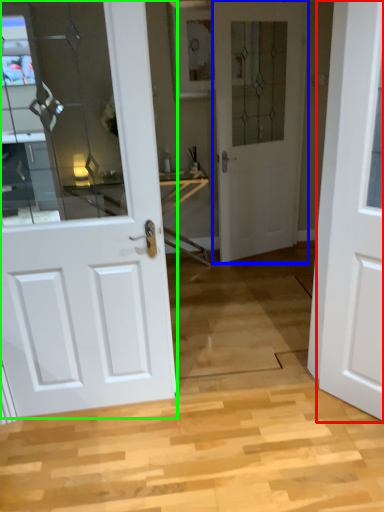
Question: Which object is positioned closest to door (highlighted by a red box)? Select from door (highlighted by a blue box) and door (highlighted by a green box).

Choices:
 (A) door
 (B) door

Answer: (B)